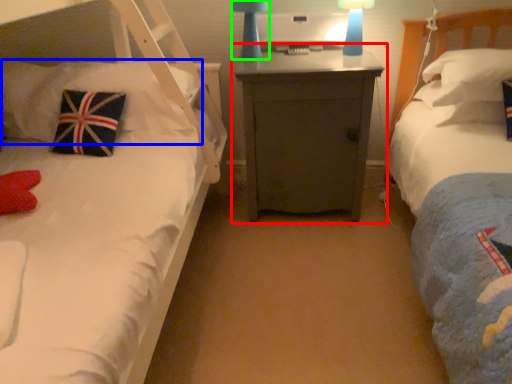
Question: Which object is positioned closest to nightstand (highlighted by a red box)? Select from pillow (highlighted by a blue box) and bedside lamp (highlighted by a green box).

Choices:
 (A) pillow
 (B) bedside lamp

Answer: (B)